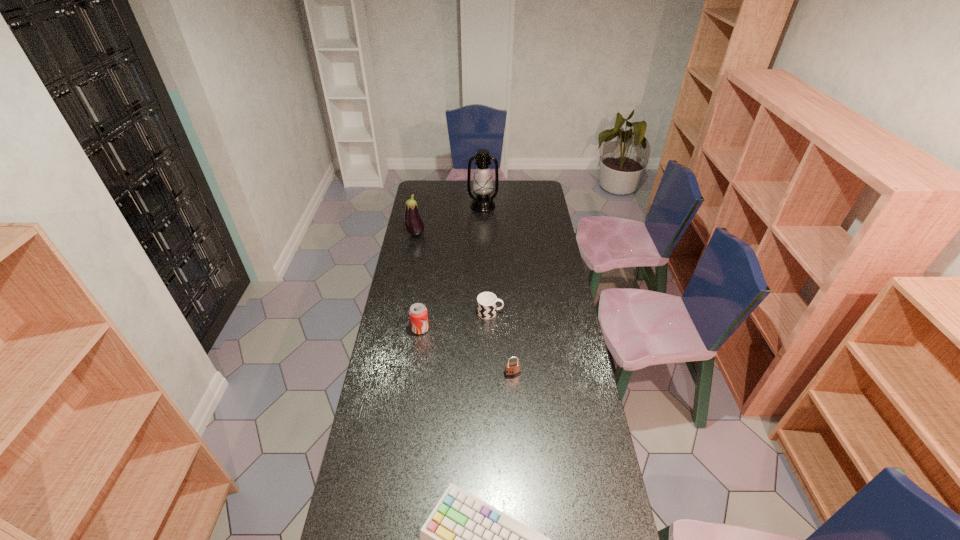
The height and width of the screenshot is (540, 960). Find the location of `free spot that satisfies the following two spatial constraints: 1. on the side of the cup with the handle; 2. on the front side of the soda can`. free spot that satisfies the following two spatial constraints: 1. on the side of the cup with the handle; 2. on the front side of the soda can is located at coordinates (491, 329).